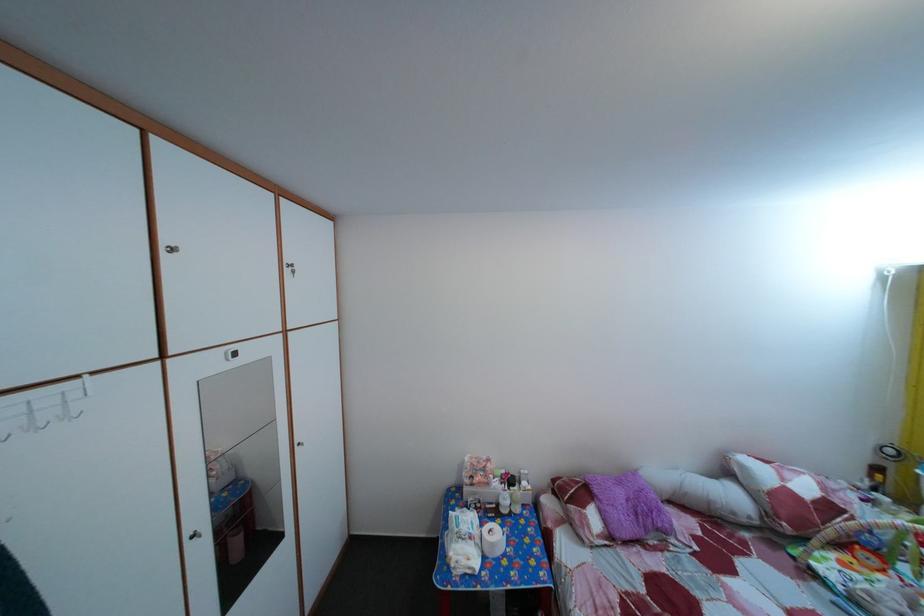
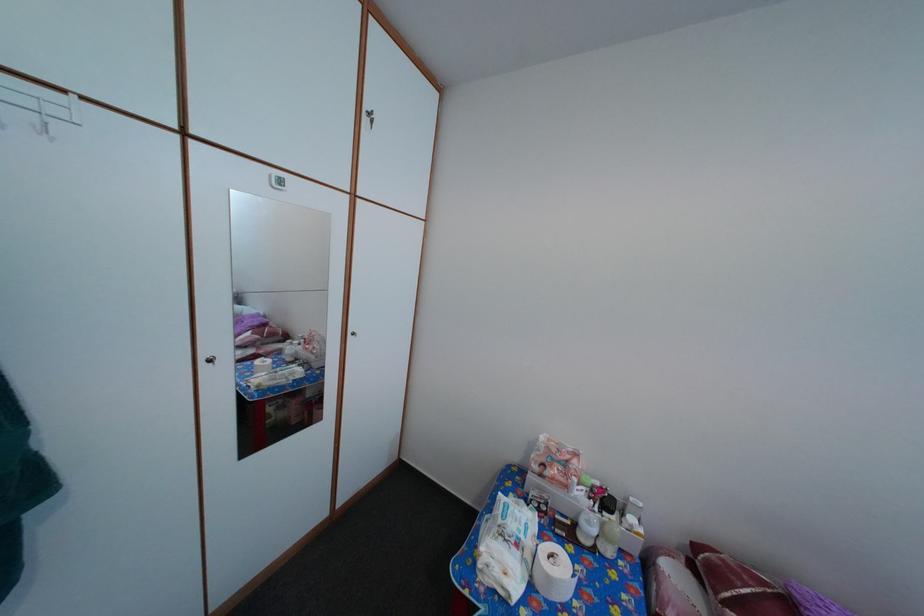
In the second image, find the point that corresponds to point (493, 476) in the first image.

(576, 469)